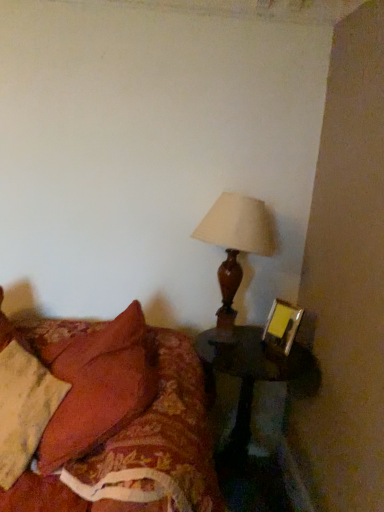
Question: Does black wood side table at lower right turn towards matte brown lamp at upper right?

Choices:
 (A) no
 (B) yes

Answer: (A)

Question: Does black wood side table at lower right have a lesser width compared to matte brown lamp at upper right?

Choices:
 (A) yes
 (B) no

Answer: (B)

Question: Is the position of black wood side table at lower right less distant than that of matte brown lamp at upper right?

Choices:
 (A) yes
 (B) no

Answer: (A)

Question: Does black wood side table at lower right have a greater height compared to matte brown lamp at upper right?

Choices:
 (A) no
 (B) yes

Answer: (B)

Question: Is matte brown lamp at upper right surrounded by black wood side table at lower right?

Choices:
 (A) yes
 (B) no

Answer: (B)

Question: From the image's perspective, is black wood side table at lower right beneath matte brown lamp at upper right?

Choices:
 (A) yes
 (B) no

Answer: (A)

Question: Is matte gold picture frame at right turned away from black wood side table at lower right?

Choices:
 (A) yes
 (B) no

Answer: (B)

Question: Is matte gold picture frame at right positioned before black wood side table at lower right?

Choices:
 (A) yes
 (B) no

Answer: (B)

Question: Is matte gold picture frame at right to the left of black wood side table at lower right from the viewer's perspective?

Choices:
 (A) no
 (B) yes

Answer: (A)

Question: Considering the relative sizes of matte gold picture frame at right and black wood side table at lower right in the image provided, is matte gold picture frame at right thinner than black wood side table at lower right?

Choices:
 (A) yes
 (B) no

Answer: (A)

Question: Is matte gold picture frame at right taller than black wood side table at lower right?

Choices:
 (A) yes
 (B) no

Answer: (B)

Question: Is the position of matte gold picture frame at right more distant than that of black wood side table at lower right?

Choices:
 (A) no
 (B) yes

Answer: (B)

Question: Can you confirm if floral fabric bed at lower left is thinner than matte brown lamp at upper right?

Choices:
 (A) yes
 (B) no

Answer: (B)